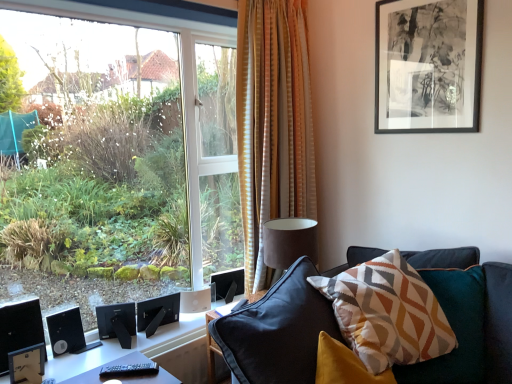
The width and height of the screenshot is (512, 384). Identify the location of free location to the right of black matte speaker at lower left, acting as the second speaker starting from the left. (157, 340).